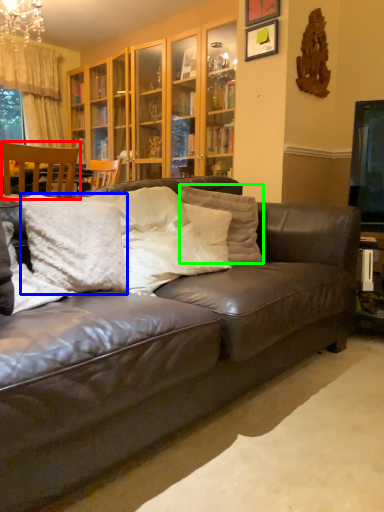
Question: Which is farther away from chair (highlighted by a red box)? pillow (highlighted by a blue box) or pillow (highlighted by a green box)?

Choices:
 (A) pillow
 (B) pillow

Answer: (A)